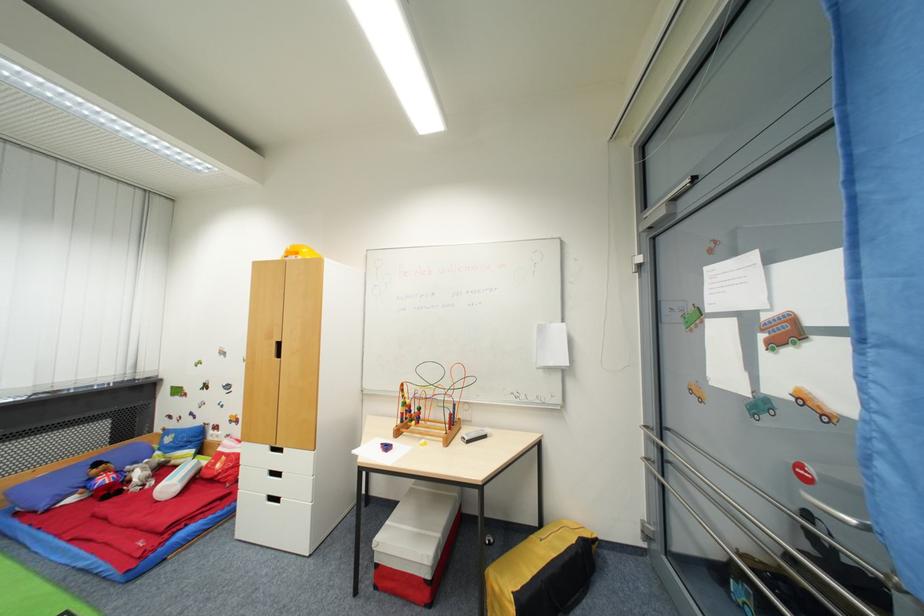
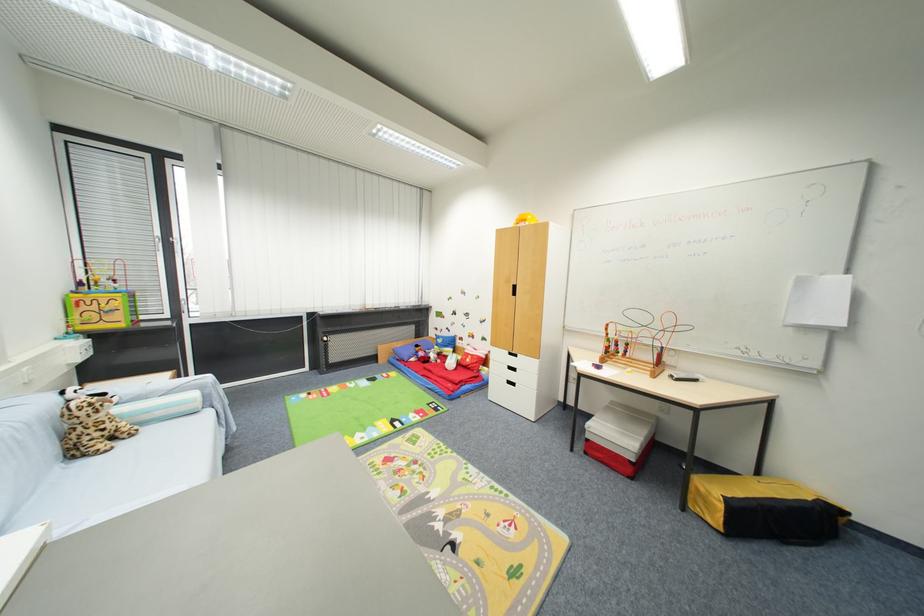
Question: Based on the continuous images, in which direction is the camera rotating? Reply with the corresponding letter.

Choices:
 (A) Left
 (B) Right
 (C) Up
 (D) Down

Answer: (A)